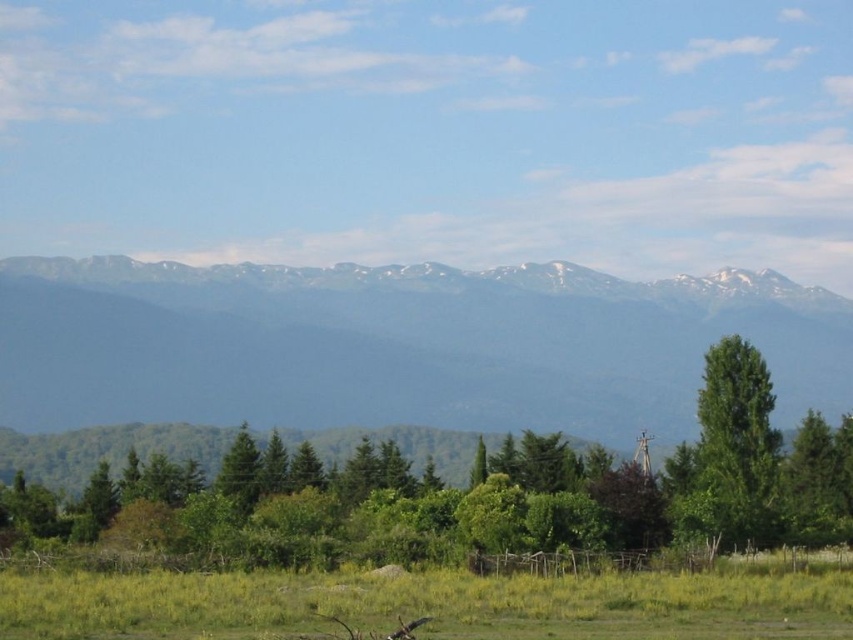
Is grayish-blue mountain range at upper center positioned behind green grassy field at lower center?

Yes, it is.

Between grayish-blue mountain range at upper center and green grassy field at lower center, which one has more height?

grayish-blue mountain range at upper center

Between point (165, 417) and point (811, 616), which one is positioned behind?

The point (165, 417) is more distant.

Where is `grayish-blue mountain range at upper center`? grayish-blue mountain range at upper center is located at coordinates (398, 344).

Which is more to the left, green leafy tree at center or green grassy field at lower center?

green leafy tree at center is more to the left.

Who is more forward, (253, 552) or (149, 580)?

Point (149, 580) is more forward.

Identify the location of green leafy tree at center. Image resolution: width=853 pixels, height=640 pixels. (517, 484).

Does grayish-blue mountain range at upper center have a larger size compared to green leafy tree at right?

Yes.

Is grayish-blue mountain range at upper center wider than green leafy tree at right?

Correct, the width of grayish-blue mountain range at upper center exceeds that of green leafy tree at right.

Who is more distant from viewer, [611,403] or [764,476]?

Positioned behind is point [611,403].

The height and width of the screenshot is (640, 853). What are the coordinates of `grayish-blue mountain range at upper center` in the screenshot? It's located at (398, 344).